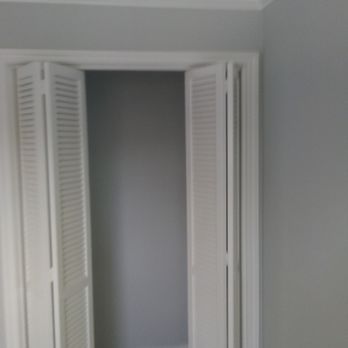
Where is `screws (in closet doors)`? Image resolution: width=348 pixels, height=348 pixels. screws (in closet doors) is located at coordinates (226, 87).